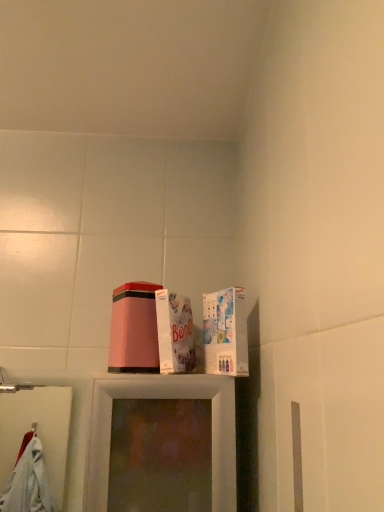
This screenshot has height=512, width=384. Describe the element at coordinates (225, 332) in the screenshot. I see `white cardboard box at upper right, the 1th box in the right-to-left sequence` at that location.

Measure the distance between white cardboard box at upper right, the 1th box in the right-to-left sequence, and camera.

white cardboard box at upper right, the 1th box in the right-to-left sequence, and camera are 34.55 inches apart.

Image resolution: width=384 pixels, height=512 pixels. In order to click on white cardboard box at upper right, the 1th box in the right-to-left sequence in this screenshot , I will do `click(225, 332)`.

In order to face white cardboard box at upper right, the 1th box in the right-to-left sequence, should I rotate leftwards or rightwards?

You should rotate right by 4.174 degrees.

Measure the distance between white cardboard box at center, which is the 1th box in left-to-right order, and camera.

The depth of white cardboard box at center, which is the 1th box in left-to-right order, is 35.33 inches.

Image resolution: width=384 pixels, height=512 pixels. Describe the element at coordinates (175, 332) in the screenshot. I see `white cardboard box at center, which is the 1th box in left-to-right order` at that location.

Locate an element on the screen. white cardboard box at center, the 2th box in the right-to-left sequence is located at coordinates (175, 332).

The image size is (384, 512). Identify the location of white cardboard box at upper right, the 1th box in the right-to-left sequence. (225, 332).

Can you confirm if white cardboard box at upper right, which is the 2th box from left to right, is positioned to the right of white cardboard box at center, the 2th box in the right-to-left sequence?

Yes, white cardboard box at upper right, which is the 2th box from left to right, is to the right of white cardboard box at center, the 2th box in the right-to-left sequence.

Considering their positions, is white cardboard box at upper right, the 1th box in the right-to-left sequence, located in front of or behind white cardboard box at center, the 2th box in the right-to-left sequence?

white cardboard box at upper right, the 1th box in the right-to-left sequence, is positioned closer to the viewer than white cardboard box at center, the 2th box in the right-to-left sequence.

Considering the points (222, 302) and (170, 320), which point is in front, point (222, 302) or point (170, 320)?

Positioned in front is point (222, 302).

From the image's perspective, is white cardboard box at upper right, the 1th box in the right-to-left sequence, on top of white cardboard box at center, which is the 1th box in left-to-right order?

Actually, white cardboard box at upper right, the 1th box in the right-to-left sequence, appears below white cardboard box at center, which is the 1th box in left-to-right order, in the image.

From a real-world perspective, between white cardboard box at upper right, which is the 2th box from left to right, and white cardboard box at center, the 2th box in the right-to-left sequence, who is vertically higher?

In real-world perspective, white cardboard box at center, the 2th box in the right-to-left sequence, is above.

Considering the relative sizes of white cardboard box at upper right, which is the 2th box from left to right, and white cardboard box at center, the 2th box in the right-to-left sequence, in the image provided, is white cardboard box at upper right, which is the 2th box from left to right, wider than white cardboard box at center, the 2th box in the right-to-left sequence,?

No, white cardboard box at upper right, which is the 2th box from left to right, is not wider than white cardboard box at center, the 2th box in the right-to-left sequence.

Does white cardboard box at upper right, which is the 2th box from left to right, have a greater height compared to white cardboard box at center, which is the 1th box in left-to-right order?

Incorrect, the height of white cardboard box at upper right, which is the 2th box from left to right, is not larger of that of white cardboard box at center, which is the 1th box in left-to-right order.

Can you confirm if white cardboard box at upper right, which is the 2th box from left to right, is bigger than white cardboard box at center, which is the 1th box in left-to-right order?

Incorrect, white cardboard box at upper right, which is the 2th box from left to right, is not larger than white cardboard box at center, which is the 1th box in left-to-right order.

Can white cardboard box at center, which is the 1th box in left-to-right order, be found inside white cardboard box at upper right, the 1th box in the right-to-left sequence?

Definitely not — white cardboard box at center, which is the 1th box in left-to-right order, is not inside white cardboard box at upper right, the 1th box in the right-to-left sequence.

Is white cardboard box at upper right, which is the 2th box from left to right, not near white cardboard box at center, which is the 1th box in left-to-right order?

That's not correct — white cardboard box at upper right, which is the 2th box from left to right, is a little close to white cardboard box at center, which is the 1th box in left-to-right order.

Consider the image. Is white cardboard box at upper right, the 1th box in the right-to-left sequence, positioned with its back to white cardboard box at center, which is the 1th box in left-to-right order?

No, white cardboard box at upper right, the 1th box in the right-to-left sequence, is not facing away from white cardboard box at center, which is the 1th box in left-to-right order.

How distant is white cardboard box at upper right, which is the 2th box from left to right, from white cardboard box at center, the 2th box in the right-to-left sequence?

A distance of 8.64 centimeters exists between white cardboard box at upper right, which is the 2th box from left to right, and white cardboard box at center, the 2th box in the right-to-left sequence.

Where is `box below the white cardboard box at center, which is the 1th box in left-to-right order (from a real-world perspective)`? The image size is (384, 512). box below the white cardboard box at center, which is the 1th box in left-to-right order (from a real-world perspective) is located at coordinates (225, 332).

Does white cardboard box at center, the 2th box in the right-to-left sequence, appear on the right side of white cardboard box at upper right, which is the 2th box from left to right?

No, white cardboard box at center, the 2th box in the right-to-left sequence, is not to the right of white cardboard box at upper right, which is the 2th box from left to right.

Considering their positions, is white cardboard box at center, which is the 1th box in left-to-right order, located in front of or behind white cardboard box at upper right, the 1th box in the right-to-left sequence?

white cardboard box at center, which is the 1th box in left-to-right order, is positioned farther from the viewer than white cardboard box at upper right, the 1th box in the right-to-left sequence.

Is point (181, 358) more distant than point (203, 303)?

No.

From the image's perspective, who appears lower, white cardboard box at center, which is the 1th box in left-to-right order, or white cardboard box at upper right, which is the 2th box from left to right?

white cardboard box at upper right, which is the 2th box from left to right.

Looking at this image, from a real-world perspective, which object rests below the other?

white cardboard box at upper right, the 1th box in the right-to-left sequence.

Considering the relative sizes of white cardboard box at center, the 2th box in the right-to-left sequence, and white cardboard box at upper right, which is the 2th box from left to right, in the image provided, is white cardboard box at center, the 2th box in the right-to-left sequence, wider than white cardboard box at upper right, which is the 2th box from left to right,?

Yes.

Does white cardboard box at center, which is the 1th box in left-to-right order, have a greater height compared to white cardboard box at upper right, which is the 2th box from left to right?

Correct, white cardboard box at center, which is the 1th box in left-to-right order, is much taller as white cardboard box at upper right, which is the 2th box from left to right.

Considering the relative sizes of white cardboard box at center, the 2th box in the right-to-left sequence, and white cardboard box at upper right, the 1th box in the right-to-left sequence, in the image provided, is white cardboard box at center, the 2th box in the right-to-left sequence, bigger than white cardboard box at upper right, the 1th box in the right-to-left sequence,?

Correct, white cardboard box at center, the 2th box in the right-to-left sequence, is larger in size than white cardboard box at upper right, the 1th box in the right-to-left sequence.

Is white cardboard box at upper right, the 1th box in the right-to-left sequence, located within white cardboard box at center, the 2th box in the right-to-left sequence?

No.

Consider the image. Are white cardboard box at center, which is the 1th box in left-to-right order, and white cardboard box at upper right, which is the 2th box from left to right, far apart?

No, white cardboard box at center, which is the 1th box in left-to-right order, is in close proximity to white cardboard box at upper right, which is the 2th box from left to right.

Is white cardboard box at center, the 2th box in the right-to-left sequence, aimed at white cardboard box at upper right, the 1th box in the right-to-left sequence?

No, white cardboard box at center, the 2th box in the right-to-left sequence, is not facing towards white cardboard box at upper right, the 1th box in the right-to-left sequence.

How many degrees apart are the facing directions of white cardboard box at center, the 2th box in the right-to-left sequence, and white cardboard box at upper right, the 1th box in the right-to-left sequence?

38.9 degrees.

Find the location of a particular element. The image size is (384, 512). box above the white cardboard box at upper right, which is the 2th box from left to right (from the image's perspective) is located at coordinates (175, 332).

You are a GUI agent. You are given a task and a screenshot of the screen. Output one action in this format:
    pyautogui.click(x=<x>, y=<y>)
    Task: Click on the box above the white cardboard box at upper right, the 1th box in the right-to-left sequence (from the image's perspective)
    
    Given the screenshot: What is the action you would take?
    pyautogui.click(x=175, y=332)

Find the location of a particular element. box that is above the white cardboard box at upper right, which is the 2th box from left to right (from a real-world perspective) is located at coordinates click(175, 332).